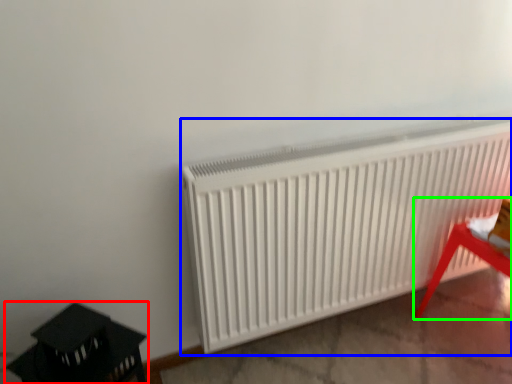
Question: Considering the real-world distances, which object is closest to furniture (highlighted by a red box)? radiator (highlighted by a blue box) or furniture (highlighted by a green box).

Choices:
 (A) radiator
 (B) furniture

Answer: (A)